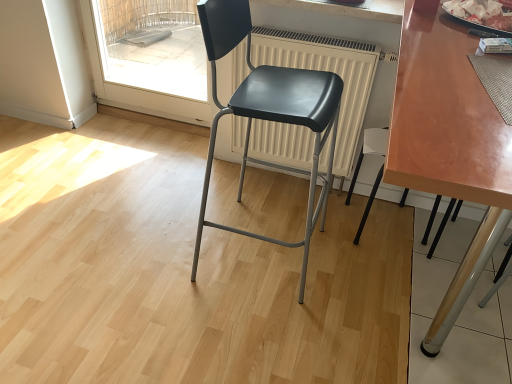
Locate an element on the screen. The height and width of the screenshot is (384, 512). vacant space underneath white matte radiator at center (from a real-world perspective) is located at coordinates (303, 187).